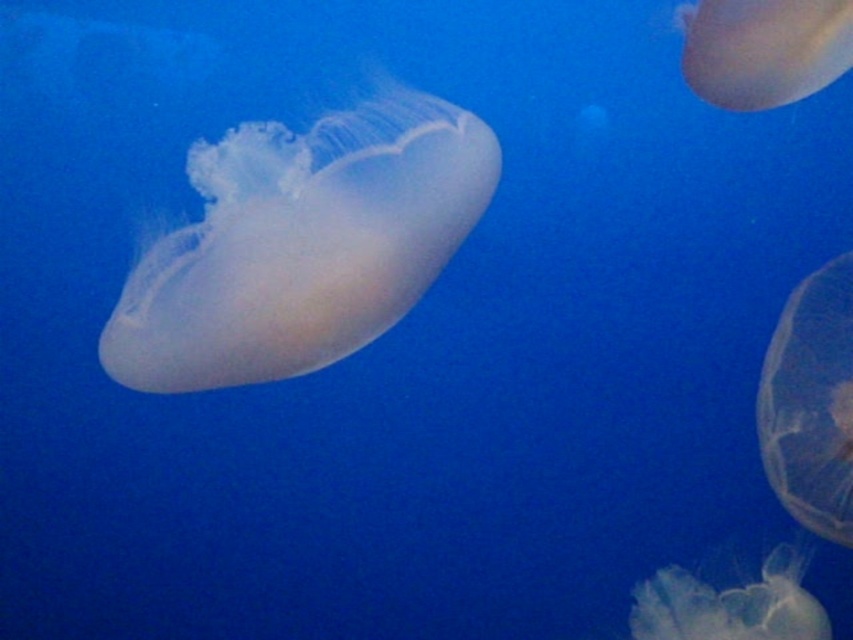
Who is positioned more to the left, transparent gelatinous at right or translucent gelatinous at upper right?

Positioned to the left is translucent gelatinous at upper right.

Who is more distant from viewer, (813, 406) or (825, 83)?

Point (825, 83)

Who is more distant from viewer, [804,298] or [753,109]?

Point [753,109]

Where is `transparent gelatinous at right`? transparent gelatinous at right is located at coordinates (811, 403).

Is transparent gelatinous at right smaller than translucent gelatinous at lower right?

Actually, transparent gelatinous at right might be larger than translucent gelatinous at lower right.

Is transparent gelatinous at right wider than translucent gelatinous at lower right?

No.

Does point (840, 465) come behind point (682, 627)?

No.

Where is `transparent gelatinous at right`? transparent gelatinous at right is located at coordinates (811, 403).

Measure the distance between translucent gelatinous at upper right and translucent gelatinous at lower right.

The distance of translucent gelatinous at upper right from translucent gelatinous at lower right is 25.19 inches.

Is translucent gelatinous at upper right wider than translucent gelatinous at lower right?

In fact, translucent gelatinous at upper right might be narrower than translucent gelatinous at lower right.

This screenshot has width=853, height=640. What are the coordinates of `translucent gelatinous at upper right` in the screenshot? It's located at (764, 49).